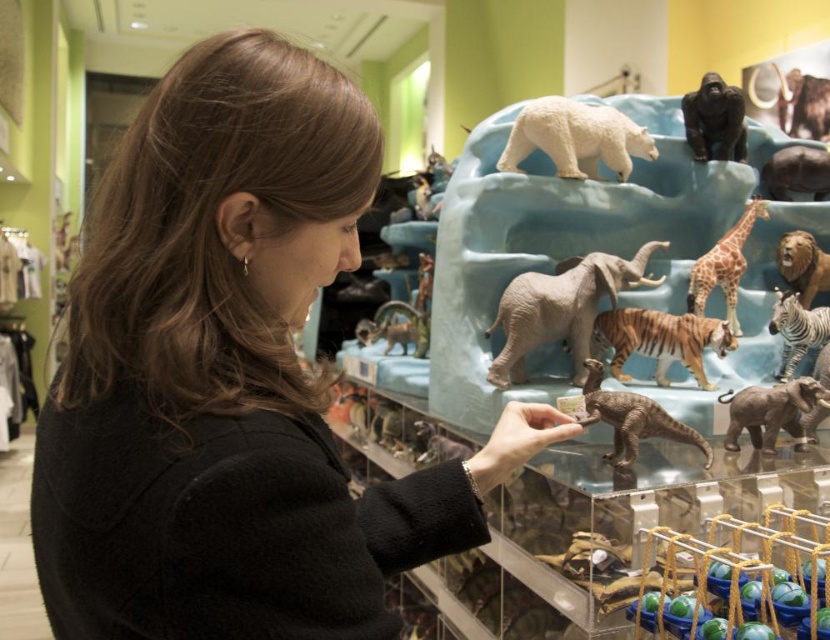
You are a customer in the store and want to reach both points marked as point (x=726, y=278) and point (x=788, y=125). Which point should you approach first to get to both points in the most efficient way?

You should approach point (x=726, y=278) first since it is in front of point (x=788, y=125), so reaching it first allows you to access both points without backtracking.

You are a customer in a toy store holding a 12 inch ruler. You want to measure the distance between the brown matte dinosaur at center and the spotted giraffe at center. Can you accurately measure this distance using your ruler?

The distance between the brown matte dinosaur at center and the spotted giraffe at center is 23.33 inches. Since your ruler is only 12 inches long, you cannot accurately measure the full distance between them with a single measurement. You would need to make multiple measurements or use a longer tool.